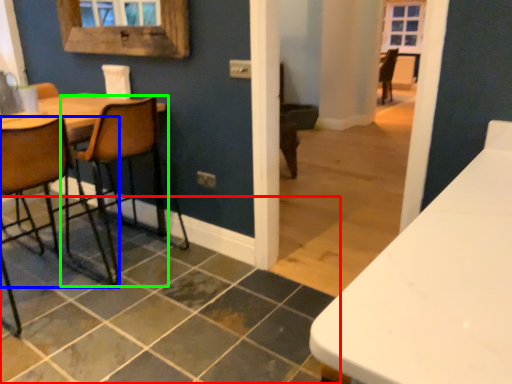
Question: Which object is positioned closest to tile (highlighted by a red box)? Select from chair (highlighted by a blue box) and chair (highlighted by a green box).

Choices:
 (A) chair
 (B) chair

Answer: (A)